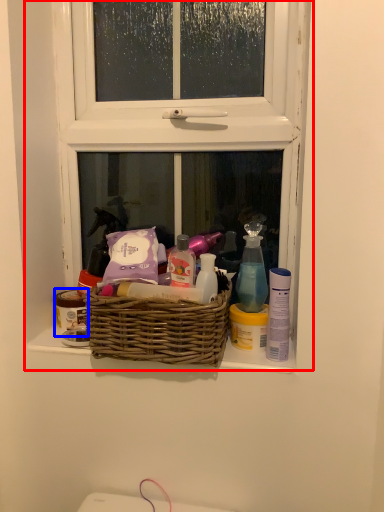
Question: Which of the following is the closest to the observer, window (highlighted by a red box) or toiletry (highlighted by a blue box)?

Choices:
 (A) window
 (B) toiletry

Answer: (A)